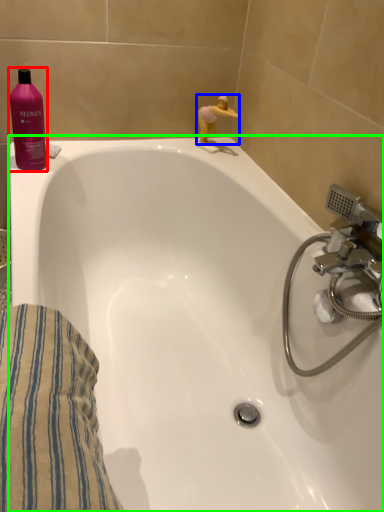
Question: Estimate the real-world distances between objects in this image. Which object is farther from cleaning product (highlighted by a red box), miniature (highlighted by a blue box) or bathtub (highlighted by a green box)?

Choices:
 (A) miniature
 (B) bathtub

Answer: (A)